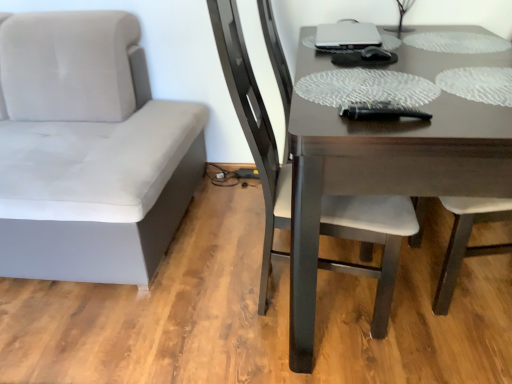
Question: Visually, is satin silver laptop at upper center positioned to the left or to the right of dark brown wooden table at center?

Choices:
 (A) left
 (B) right

Answer: (A)

Question: From a real-world perspective, is satin silver laptop at upper center physically located above or below dark brown wooden table at center?

Choices:
 (A) below
 (B) above

Answer: (B)

Question: Estimate the real-world distances between objects in this image. Which object is closer to the dark brown wooden table at center?

Choices:
 (A) dark brown wood chair at center, acting as the 1th chair starting from the right
 (B) suede gray chair at left, placed as the 2th chair when sorted from right to left
 (C) satin silver laptop at upper center

Answer: (A)

Question: Which object is the farthest from the dark brown wooden table at center?

Choices:
 (A) suede gray chair at left, placed as the 2th chair when sorted from right to left
 (B) dark brown wood chair at center, arranged as the second chair when viewed from the left
 (C) satin silver laptop at upper center

Answer: (A)